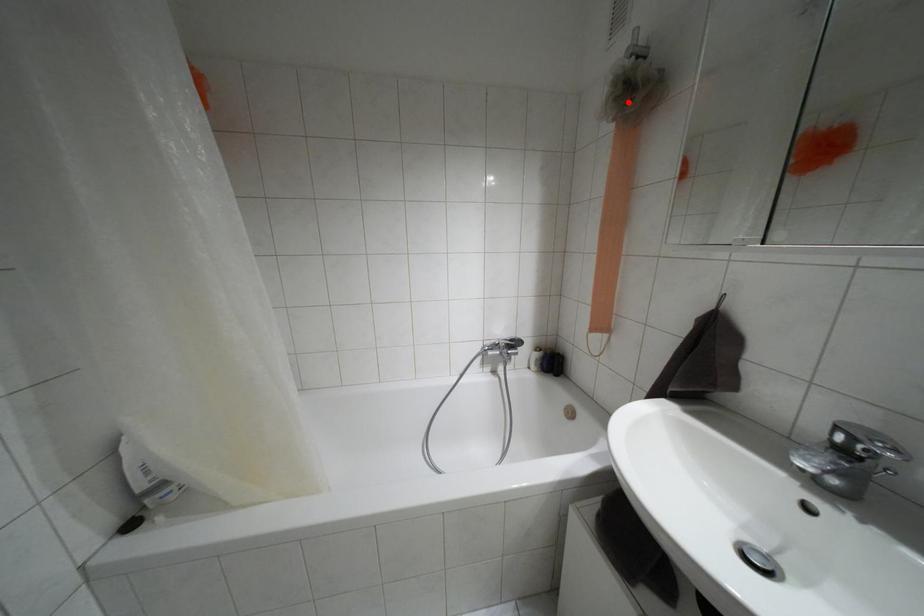
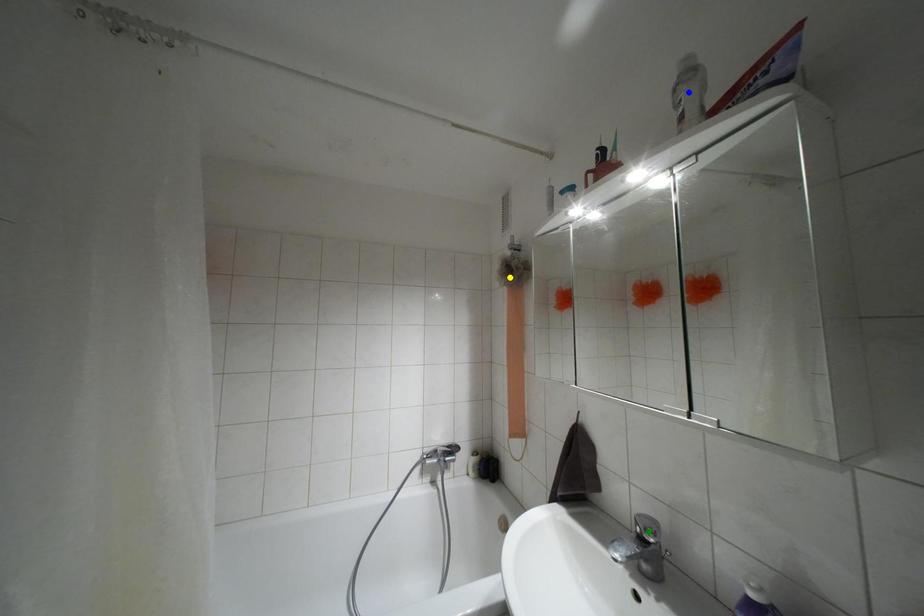
Question: I am providing you with two images of the same scene from different viewpoints. A red point is marked on the first image. You are given multiple points on the second image. Which point in image 2 represents the same 3d spot as the red point in image 1?

Choices:
 (A) blue point
 (B) green point
 (C) yellow point

Answer: (C)